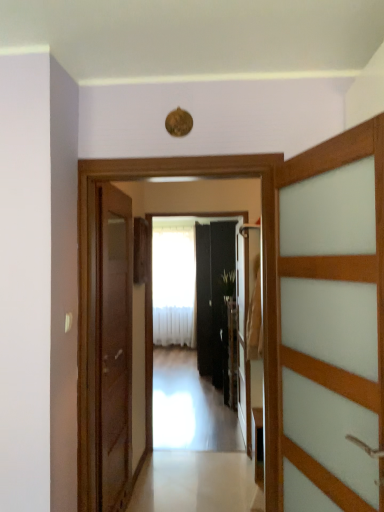
Question: Is white sheer curtain at center bigger or smaller than white glossy floor at center?

Choices:
 (A) big
 (B) small

Answer: (A)

Question: Considering the positions of point (190, 263) and point (218, 483), is point (190, 263) closer or farther from the camera than point (218, 483)?

Choices:
 (A) farther
 (B) closer

Answer: (A)

Question: Which is farther from the white glossy floor at center?

Choices:
 (A) white sheer curtain at center
 (B) black glossy door at center, which is the 3th door from left to right
 (C) green leafy plant at center
 (D) transparent glass elevator at center
 (E) wooden door at left, the third door in the right-to-left sequence

Answer: (A)

Question: Which object is the closest to the black glossy door at center, the 1th door viewed from the back?

Choices:
 (A) white glossy floor at center
 (B) white sheer curtain at center
 (C) green leafy plant at center
 (D) wooden door at right, marked as the second door in a left-to-right arrangement
 (E) wooden door at left, positioned as the 2th door in front-to-back order

Answer: (C)